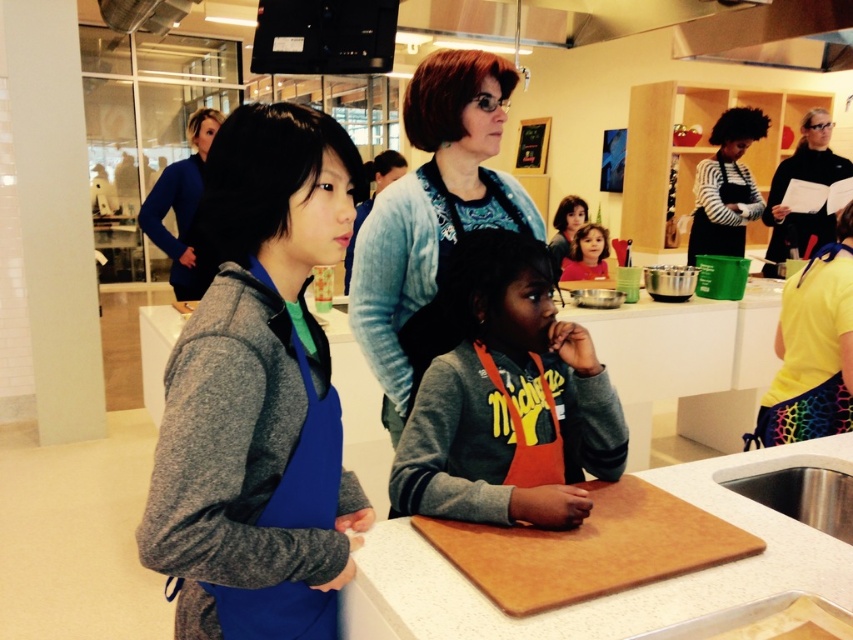
Is blue denim jacket at center above brown wooden cutting board at lower center?

Yes, blue denim jacket at center is above brown wooden cutting board at lower center.

Between blue denim jacket at center and brown wooden cutting board at lower center, which one has less height?

Standing shorter between the two is brown wooden cutting board at lower center.

Which is in front, point (445, 128) or point (683, 564)?

Point (683, 564) is in front.

Find the location of `blue denim jacket at center`. blue denim jacket at center is located at coordinates (432, 209).

Who is more distant from viewer, (453, 336) or (839, 161)?

The point (839, 161) is behind.

Can you confirm if orange apron at center is thinner than black matte apron at upper right?

Indeed, orange apron at center has a lesser width compared to black matte apron at upper right.

This screenshot has height=640, width=853. Describe the element at coordinates (503, 396) in the screenshot. I see `orange apron at center` at that location.

Where is `orange apron at center`? This screenshot has width=853, height=640. orange apron at center is located at coordinates (503, 396).

Is brown wooden cutting board at center to the left of brown wooden cutting board at lower center from the viewer's perspective?

In fact, brown wooden cutting board at center is to the right of brown wooden cutting board at lower center.

This screenshot has height=640, width=853. Describe the element at coordinates (619, 592) in the screenshot. I see `brown wooden cutting board at center` at that location.

Who is more forward, (782, 560) or (476, 545)?

Positioned in front is point (782, 560).

You are a GUI agent. You are given a task and a screenshot of the screen. Output one action in this format:
    pyautogui.click(x=<x>, y=<y>)
    Task: Click on the brown wooden cutting board at center
    This screenshot has width=853, height=640.
    Given the screenshot: What is the action you would take?
    point(619,592)